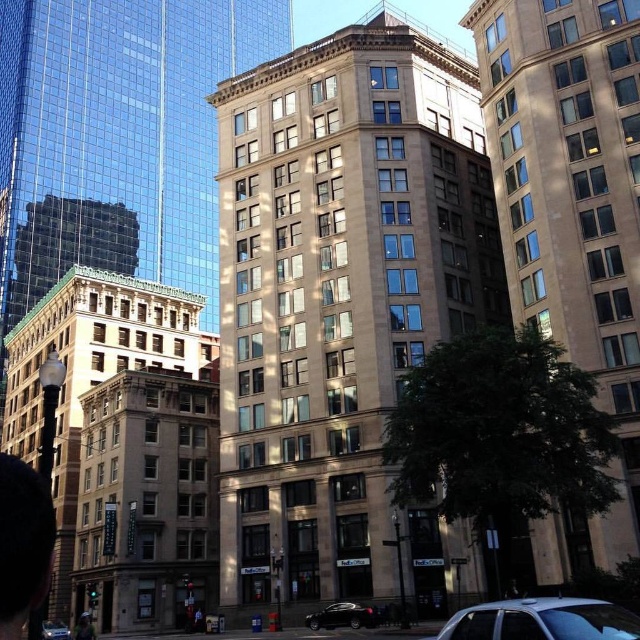
You are a pedestrian standing at the crosswalk in front of the FedEx Office. You see the shiny black sedan at lower center and the silver metallic sedan at lower left. Which car is closer to you?

The silver metallic sedan at lower left is closer to you because it is below the shiny black sedan at lower center, meaning it is positioned lower in the image and therefore nearer to the observer.

You are a delivery driver who needs to park your truck between the silver metallic car at lower right and the silver metallic sedan at lower left. The truck requires 40 meters of space. Is there enough space between them?

The distance between the silver metallic car at lower right and the silver metallic sedan at lower left is 35.30 meters, which is less than the required 40 meters. Therefore, there is not enough space to park the truck between them.